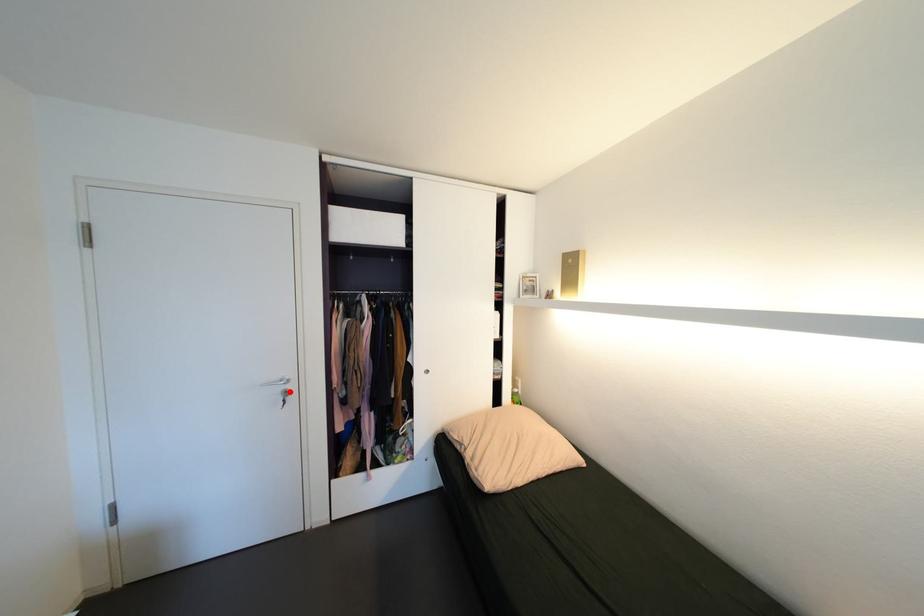
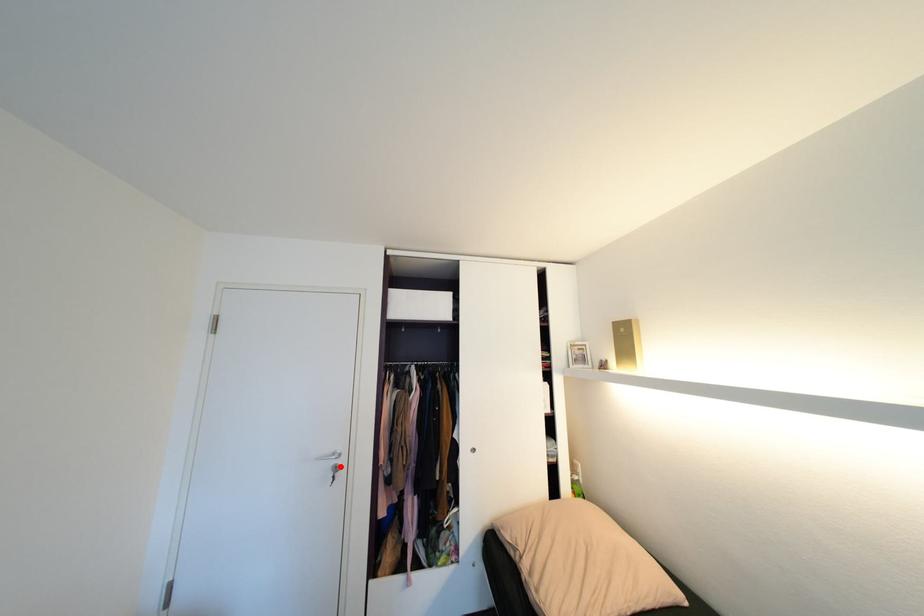
I am providing you with two images of the same scene from different viewpoints. A red point is marked on the first image and another point is marked on the second image. Do the highlighted points in image1 and image2 indicate the same real-world spot?

Yes